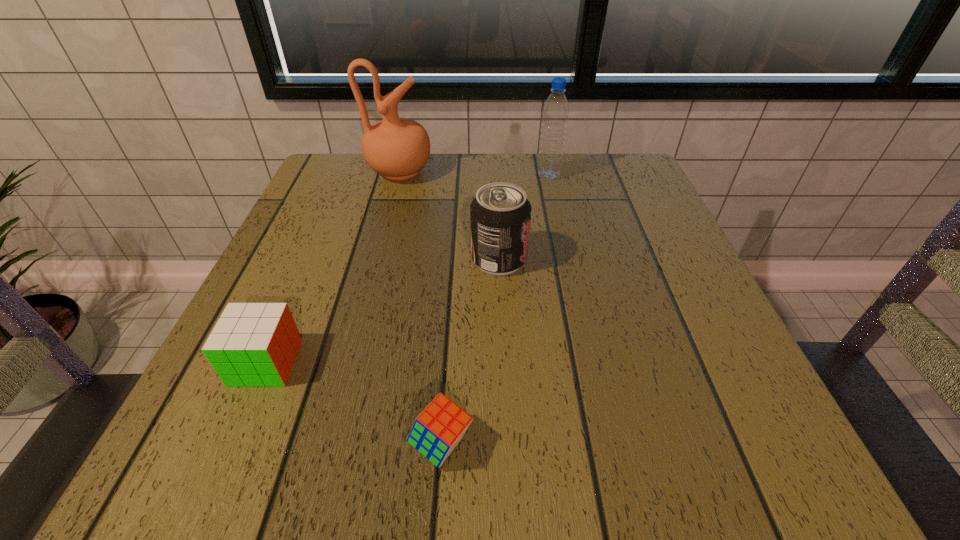
Find the location of a particular element. This screenshot has height=540, width=960. blank space that satisfies the following two spatial constraints: 1. on the spout of the pottery; 2. on the left side of the second tallest object is located at coordinates (399, 175).

Identify the location of vacant space that satisfies the following two spatial constraints: 1. on the back side of the nearer cube; 2. on the left side of the soda can. (454, 259).

Where is `blank area in the image that satisfies the following two spatial constraints: 1. on the spout of the soda can; 2. on the right side of the pottery`? blank area in the image that satisfies the following two spatial constraints: 1. on the spout of the soda can; 2. on the right side of the pottery is located at coordinates (377, 259).